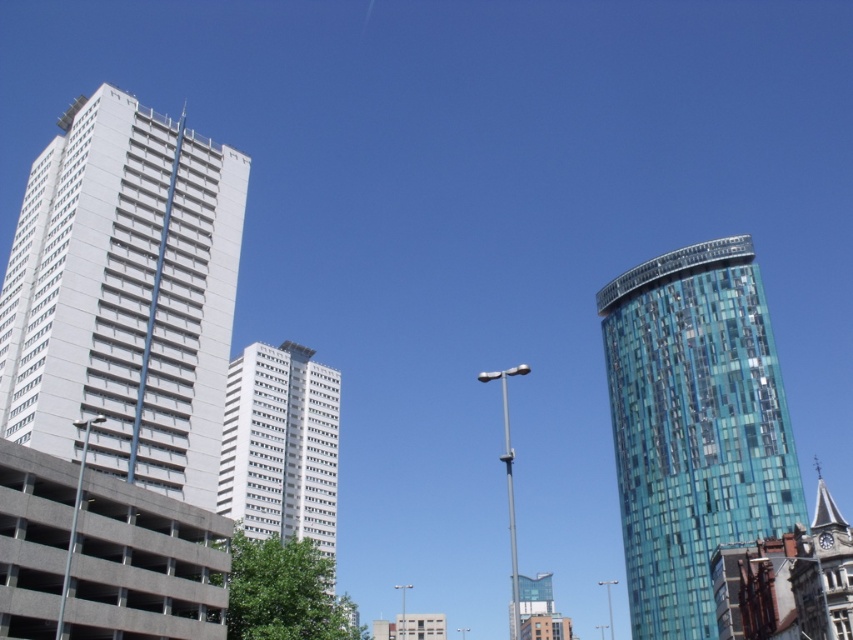
Question: Can you confirm if blue glassy tower at right is positioned above white glass building at center?

Choices:
 (A) no
 (B) yes

Answer: (B)

Question: Does blue glassy tower at right have a larger size compared to white glass building at center?

Choices:
 (A) no
 (B) yes

Answer: (A)

Question: Which object appears closest to the camera in this image?

Choices:
 (A) white smooth building at left
 (B) white glass building at center

Answer: (A)

Question: Can you confirm if white smooth building at left is thinner than blue glassy tower at right?

Choices:
 (A) yes
 (B) no

Answer: (B)

Question: Which point is closer to the camera?

Choices:
 (A) blue glassy tower at right
 (B) white glass building at center
 (C) white smooth building at left

Answer: (C)

Question: Among these points, which one is farthest from the camera?

Choices:
 (A) (701, 288)
 (B) (96, 339)

Answer: (A)